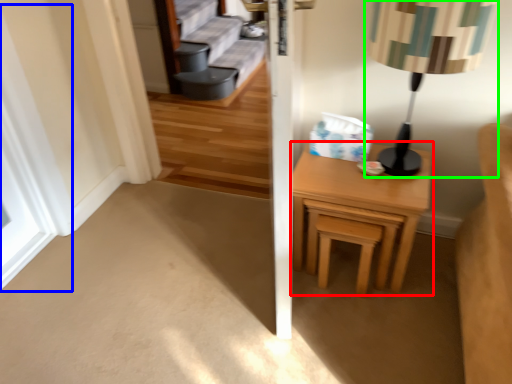
Question: Based on their relative distances, which object is nearer to nightstand (highlighted by a red box)? Choose from window (highlighted by a blue box) and table lamp (highlighted by a green box).

Choices:
 (A) window
 (B) table lamp

Answer: (B)